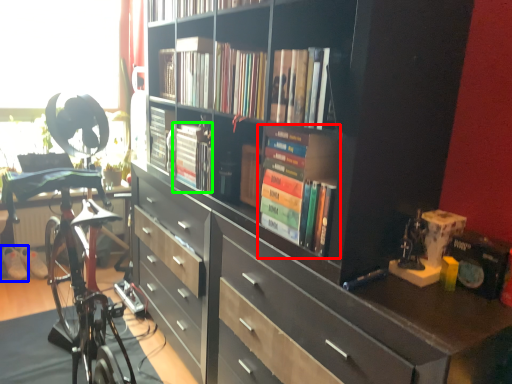
Question: Based on their relative distances, which object is farther from book (highlighted by a red box)? Choose from footwear (highlighted by a blue box) and book (highlighted by a green box).

Choices:
 (A) footwear
 (B) book

Answer: (A)